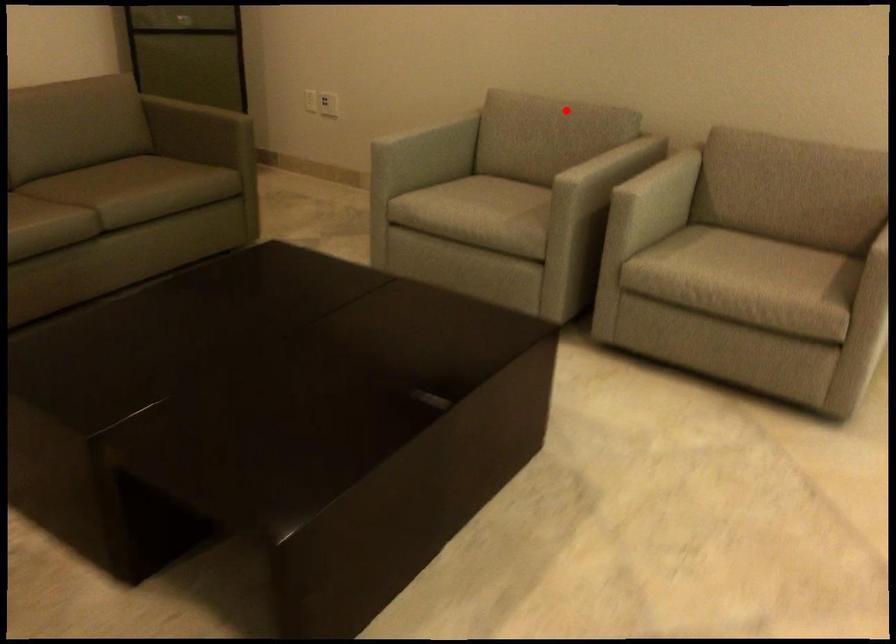
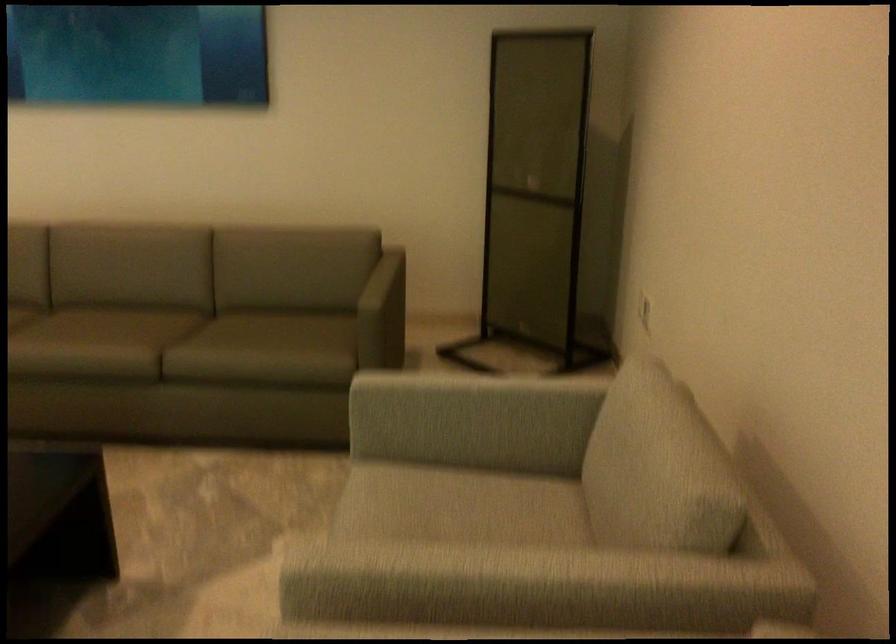
Find the pixel in the second image that matches the highlighted location in the first image.

(653, 451)